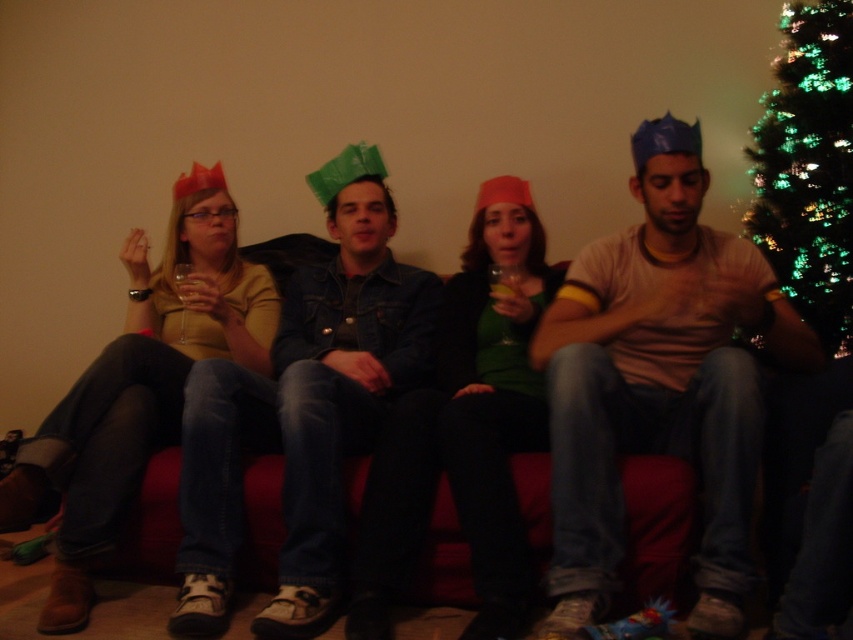
You are standing in front of the couch and want to place a small gift on the point closer to you. Which point should you choose between point (708, 538) and point (793, 120)?

You should choose point (708, 538) because it is closer to you than point (793, 120).

You are a photographer setting up for a group photo. You need to ensure that the denim jacket at center is visible without any obstruction from the green glittering lights at upper right. Based on the scene, is this possible?

Yes, the denim jacket at center is in front of the green glittering lights at upper right, so it will be visible without obstruction from them.

Which individual is wearing the matte brown shirt at center?

The third person is wearing the matte brown shirt at center.